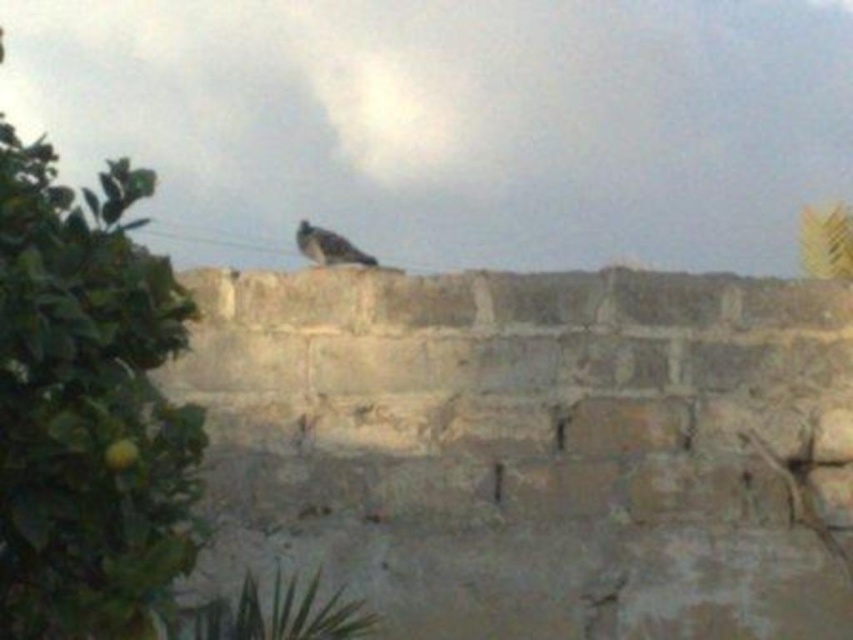
Is green leafy tree at left taller than gray feathered bird at center?

Indeed, green leafy tree at left has a greater height compared to gray feathered bird at center.

Looking at this image, is green leafy tree at left smaller than gray feathered bird at center?

Incorrect, green leafy tree at left is not smaller in size than gray feathered bird at center.

Where is `green leafy tree at left`? green leafy tree at left is located at coordinates (86, 406).